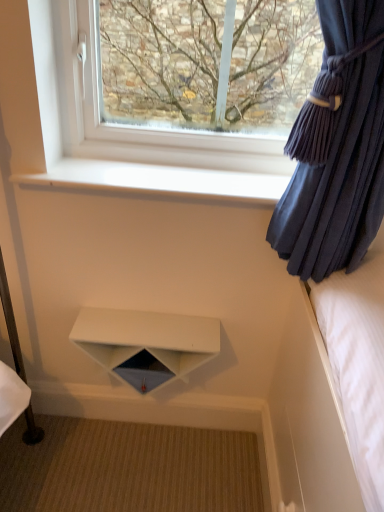
This screenshot has height=512, width=384. I want to click on free space above white matte shelf at center (from a real-world perspective), so click(152, 326).